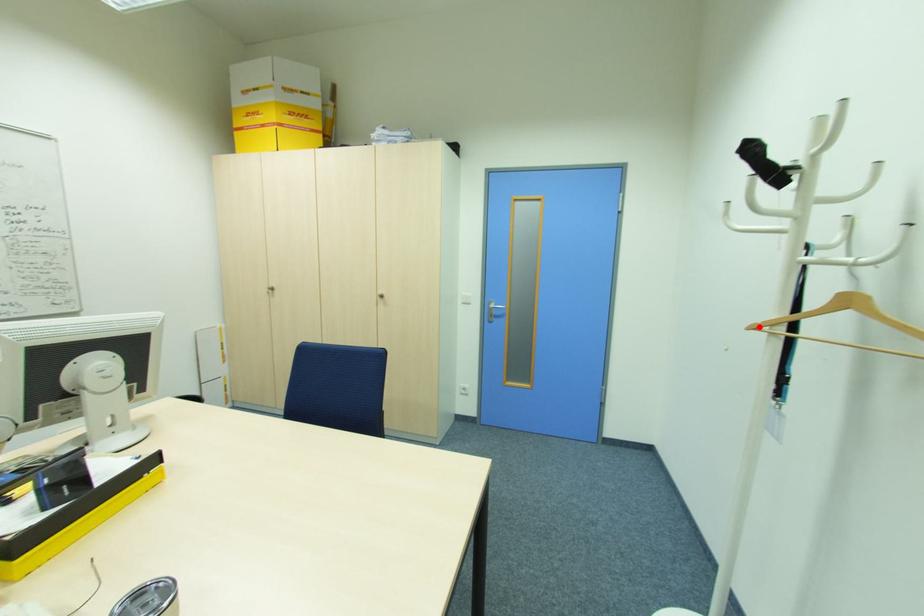
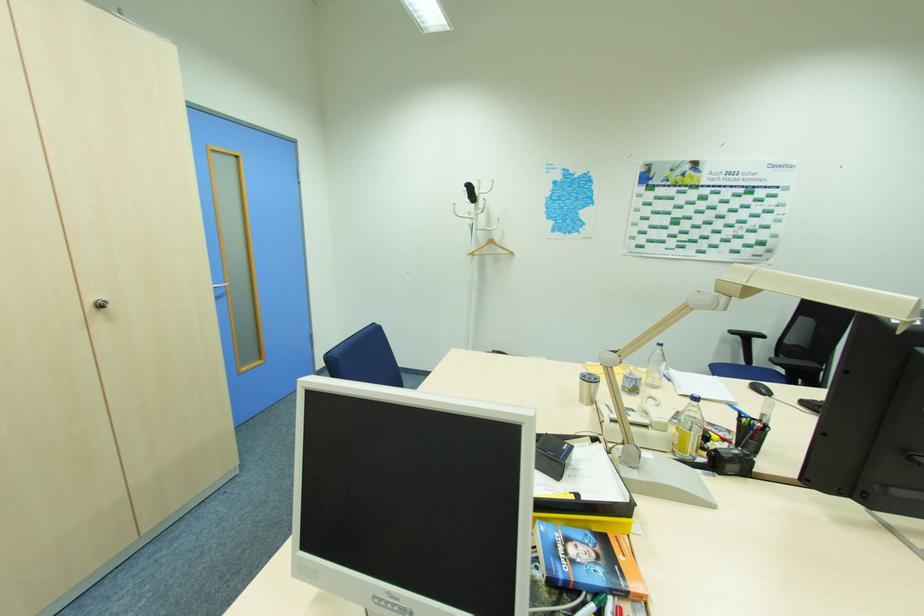
Find the pixel in the second image that matches the highlighted location in the first image.

(472, 254)